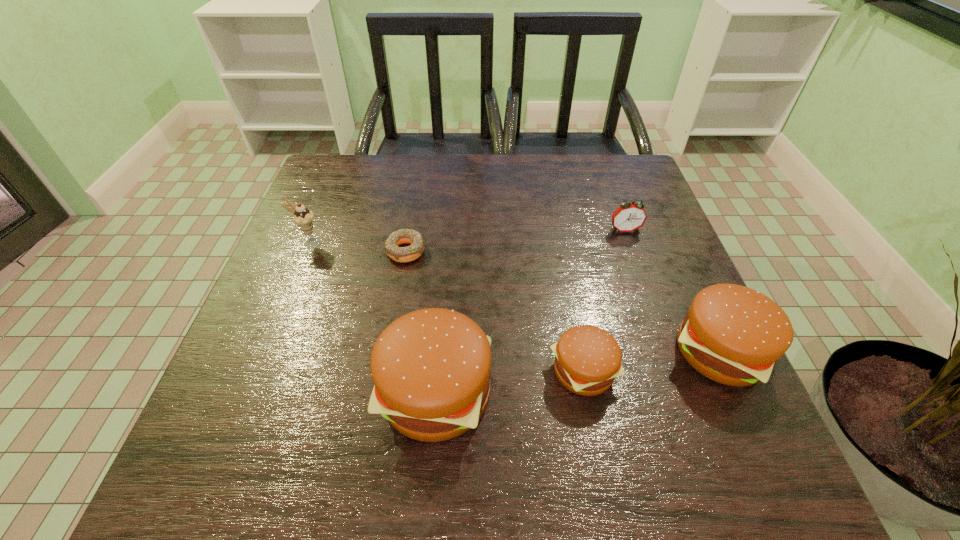
Image resolution: width=960 pixels, height=540 pixels. In order to click on vacant space at the left edge in this screenshot , I will do `click(337, 229)`.

The height and width of the screenshot is (540, 960). In the image, there is a desktop. In order to click on vacant space at the far left corner in this screenshot , I will do `click(351, 192)`.

In order to click on vacant space at the near left corner of the desktop in this screenshot , I will do `click(204, 423)`.

Image resolution: width=960 pixels, height=540 pixels. Find the location of `vacant region at the far right corner of the desktop`. vacant region at the far right corner of the desktop is located at coordinates (622, 161).

The height and width of the screenshot is (540, 960). I want to click on free space between the leftmost object and the doughnut, so click(x=357, y=247).

Locate an element on the screen. The width and height of the screenshot is (960, 540). free point between the farthest object and the rightmost hamburger is located at coordinates (672, 291).

What are the coordinates of `free spot between the farthest object and the leftmost hamburger` in the screenshot? It's located at (530, 312).

At what (x,y) coordinates should I click in order to perform the action: click on free space between the alarm clock and the leftmost object. Please return your answer as a coordinate pair (x, y). This screenshot has height=540, width=960. Looking at the image, I should click on (467, 237).

Where is `vacant space that's between the second shortest hamburger and the leftmost object`? The image size is (960, 540). vacant space that's between the second shortest hamburger and the leftmost object is located at coordinates click(515, 298).

Where is `free point between the second tallest hamburger and the leftmost object`? This screenshot has height=540, width=960. free point between the second tallest hamburger and the leftmost object is located at coordinates (515, 298).